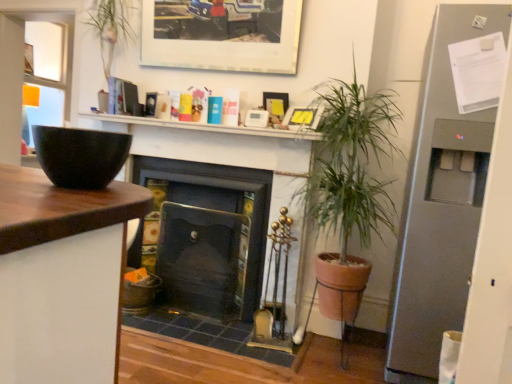
Image resolution: width=512 pixels, height=384 pixels. In order to click on vacant area in front of matte black fireplace at center, the 2th fireplace viewed from the right in this screenshot , I will do `click(192, 323)`.